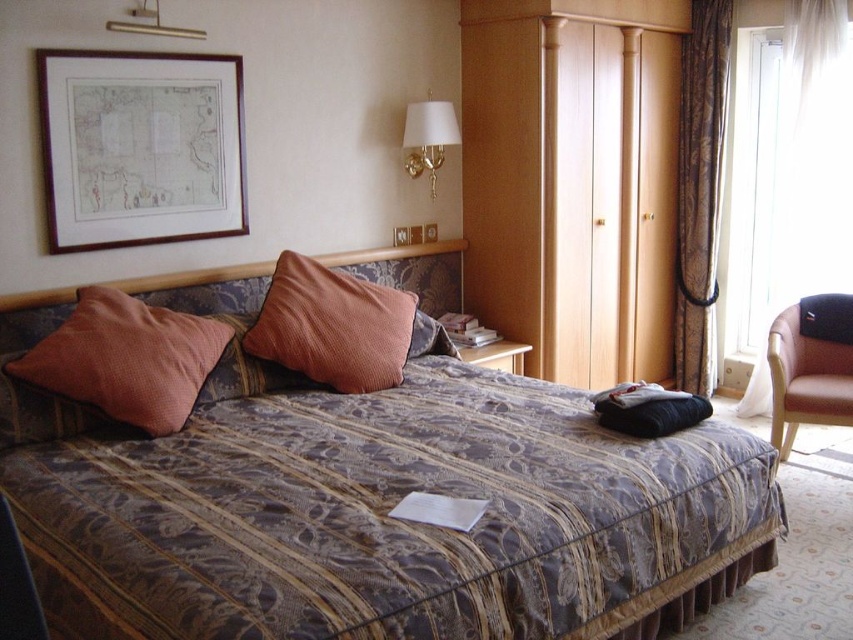
Which of these two, wooden wardrobe at center or brown textured curtain at right, stands taller?

Standing taller between the two is brown textured curtain at right.

Between point (672, 212) and point (701, 104), which one is positioned in front?

Positioned in front is point (701, 104).

The height and width of the screenshot is (640, 853). I want to click on wooden wardrobe at center, so click(x=572, y=179).

Between brown textured curtain at right and orange corduroy pillow at center, which one is positioned higher?

Positioned higher is brown textured curtain at right.

Is brown textured curtain at right to the right of orange corduroy pillow at center from the viewer's perspective?

Correct, you'll find brown textured curtain at right to the right of orange corduroy pillow at center.

Between point (679, 132) and point (306, 317), which one is positioned behind?

The point (679, 132) is behind.

The width and height of the screenshot is (853, 640). What are the coordinates of `brown textured curtain at right` in the screenshot? It's located at (699, 188).

Which is below, wooden wardrobe at center or wooden framed map at upper left?

Positioned lower is wooden wardrobe at center.

Is wooden wardrobe at center closer to camera compared to wooden framed map at upper left?

No, it is behind wooden framed map at upper left.

Is point (592, 301) positioned in front of point (86, 214)?

No, it is not.

Find the location of a particular element. wooden wardrobe at center is located at coordinates (572, 179).